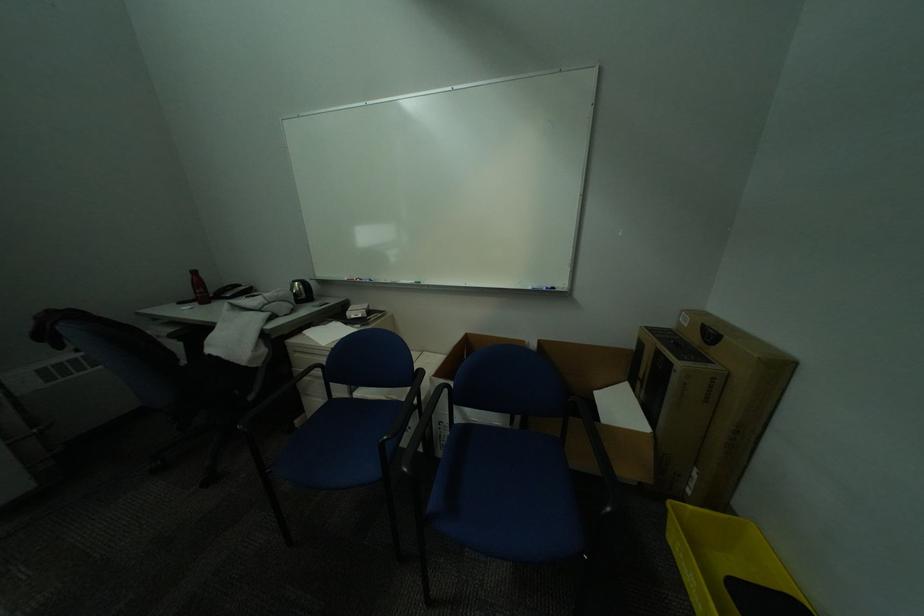
What do you see at coordinates (427, 426) in the screenshot? This screenshot has height=616, width=924. I see `the black chair armrest` at bounding box center [427, 426].